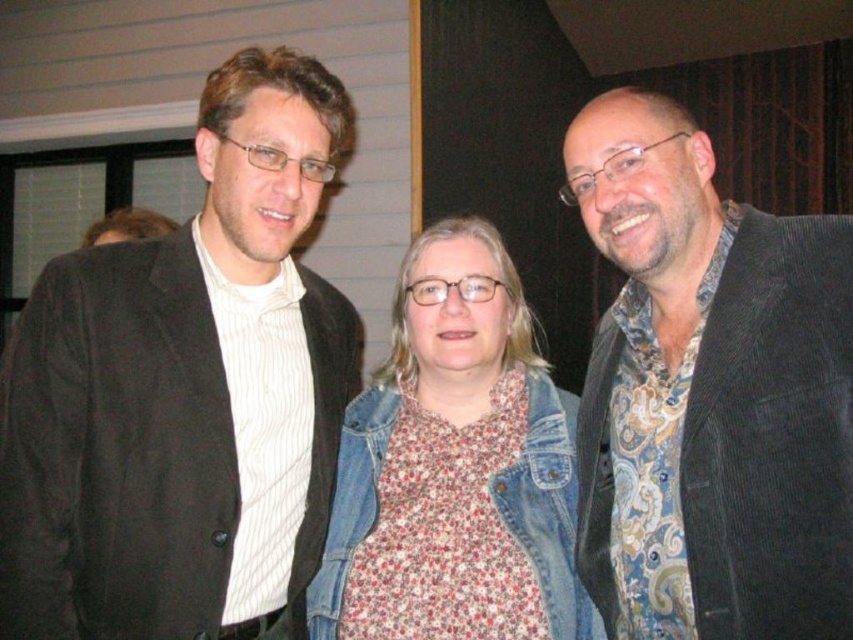
Is point (305, 296) in front of point (474, 355)?

No, (305, 296) is further to viewer.

Is matte black jacket at left further to camera compared to denim jacket at center?

No, matte black jacket at left is in front of denim jacket at center.

Is point (221, 148) farther from viewer compared to point (444, 294)?

No.

Image resolution: width=853 pixels, height=640 pixels. Find the location of `matte black jacket at left`. matte black jacket at left is located at coordinates (184, 394).

Is matte black jacket at left thinner than paisley fabric shirt at right?

No, matte black jacket at left is not thinner than paisley fabric shirt at right.

Describe the element at coordinates (184, 394) in the screenshot. The width and height of the screenshot is (853, 640). I see `matte black jacket at left` at that location.

Where is `matte black jacket at left`? Image resolution: width=853 pixels, height=640 pixels. matte black jacket at left is located at coordinates (184, 394).

Can you confirm if paisley fabric shirt at right is thinner than denim jacket at center?

Indeed, paisley fabric shirt at right has a lesser width compared to denim jacket at center.

Between point (688, 378) and point (445, 355), which one is positioned in front?

Point (688, 378)

You are a GUI agent. You are given a task and a screenshot of the screen. Output one action in this format:
    pyautogui.click(x=<x>, y=<y>)
    Task: Click on the paisley fabric shirt at right
    The image size is (853, 640).
    Given the screenshot: What is the action you would take?
    pyautogui.click(x=711, y=394)

Identify the location of paisley fabric shirt at right. (711, 394).